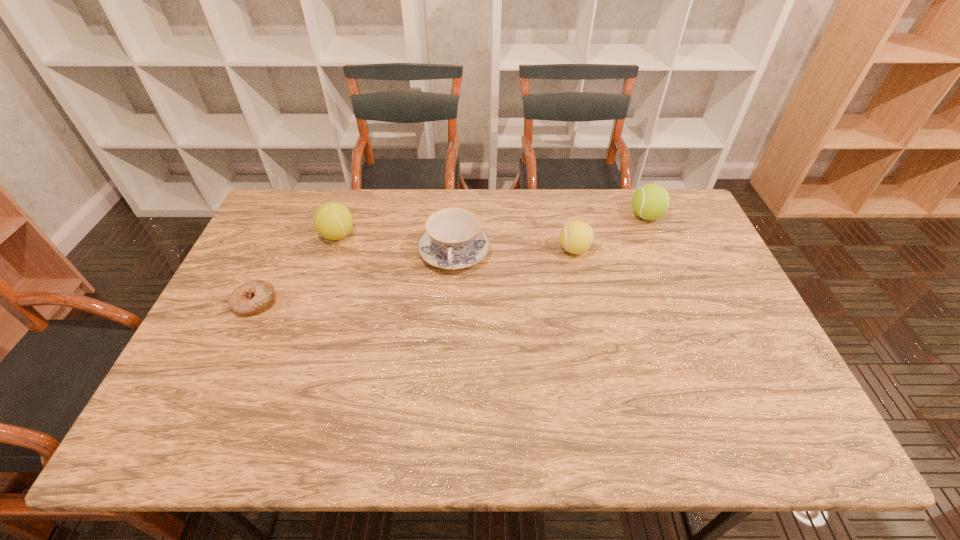
This screenshot has width=960, height=540. In order to click on the rightmost object in this screenshot , I will do `click(651, 201)`.

Where is `the leftmost tennis ball`? The height and width of the screenshot is (540, 960). the leftmost tennis ball is located at coordinates (333, 221).

Image resolution: width=960 pixels, height=540 pixels. Find the location of `chinaware`. chinaware is located at coordinates (453, 239).

Find the location of a particular element. Image resolution: width=960 pixels, height=540 pixels. the second tennis ball from right to left is located at coordinates (576, 237).

Identify the location of the nearest object. (256, 296).

In order to click on the leftmost object in this screenshot , I will do [256, 296].

Identify the location of vacant space situated 0.220m on the front of the rightmost tennis ball. (671, 275).

Identify the location of vacant space located on the right of the second object from left to right. The image size is (960, 540). (424, 235).

Locate an element on the screen. The width and height of the screenshot is (960, 540). free space located with the handle on the side of the chinaware is located at coordinates (448, 344).

The width and height of the screenshot is (960, 540). I want to click on vacant space situated 0.160m on the back of the fourth object from left to right, so click(565, 208).